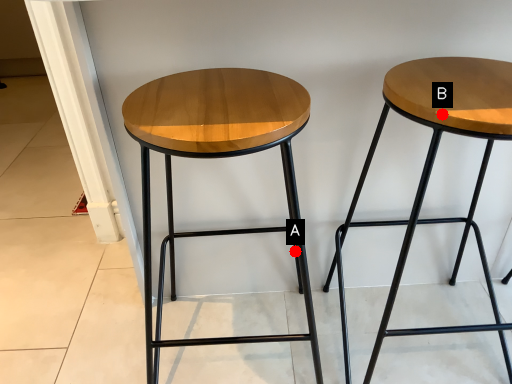
Question: Two points are circled on the image, labeled by A and B beside each circle. Among these points, which one is nearest to the camera?

Choices:
 (A) A is closer
 (B) B is closer

Answer: (B)